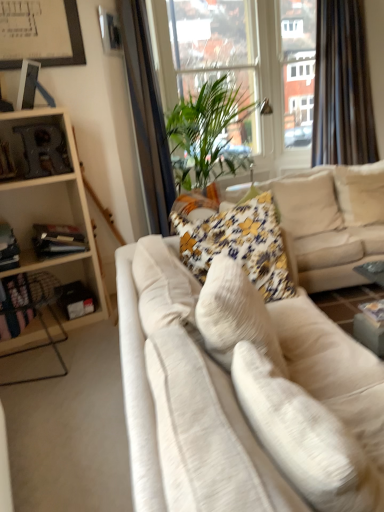
Question: Considering the positions of transparent glass window screen at upper center and velvet beige couch at center, arranged as the first studio couch when viewed from the back, in the image, is transparent glass window screen at upper center taller or shorter than velvet beige couch at center, arranged as the first studio couch when viewed from the back,?

Choices:
 (A) tall
 (B) short

Answer: (A)

Question: From the image's perspective, relative to velvet beige couch at center, the second studio couch when ordered from front to back, is transparent glass window screen at upper center above or below?

Choices:
 (A) below
 (B) above

Answer: (B)

Question: Which object is the farthest from the floral fabric pillow at center, the 3th pillow in the front-to-back sequence?

Choices:
 (A) white fabric pillow at upper right, positioned as the fourth pillow in front-to-back order
 (B) white fabric couch at center, the first studio couch viewed from the front
 (C) white fabric pillow at center, which appears as the first pillow when viewed from the front
 (D) wooden shelf at left
 (E) white plastic window frame at upper center

Answer: (C)

Question: Considering the real-world distances, which object is closest to the velvet beige couch at center, the second studio couch when ordered from front to back?

Choices:
 (A) white fabric pillow at upper right, the 1th pillow from the back
 (B) white fabric couch at center, placed as the second studio couch when sorted from back to front
 (C) white fabric pillow at center, arranged as the 4th pillow when viewed from the back
 (D) black velvet curtain at upper right
 (E) green leafy plant at center

Answer: (A)